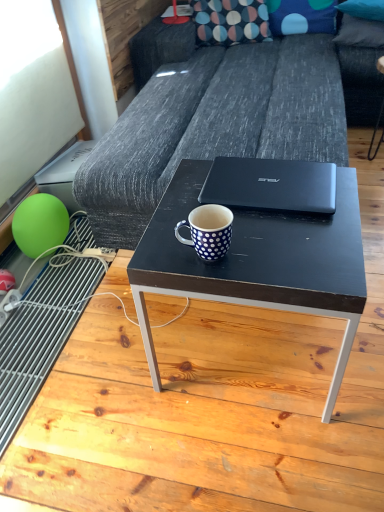
Where is `vacant area on the back side of blue dotted mug at center`? The height and width of the screenshot is (512, 384). vacant area on the back side of blue dotted mug at center is located at coordinates (186, 206).